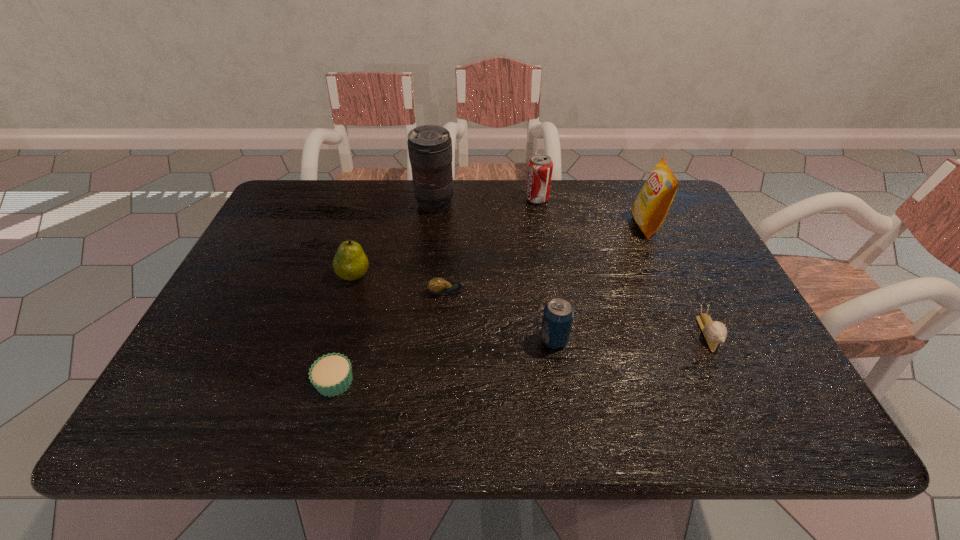
The image size is (960, 540). Find the location of `vacant region between the telephoto lens and the right escargot`. vacant region between the telephoto lens and the right escargot is located at coordinates (571, 268).

Locate an element on the screen. This screenshot has height=540, width=960. vacant space that's between the nearest object and the seventh shortest object is located at coordinates (491, 303).

Choose which object is the second nearest neighbor to the pear. Please provide its 2D coordinates. Your answer should be formatted as a tuple, i.e. [(x, y)], where the tuple contains the x and y coordinates of a point satisfying the conditions above.

[(429, 146)]

Where is `object that stands as the closest to the crisp (potato chip)`? object that stands as the closest to the crisp (potato chip) is located at coordinates (540, 167).

You are a GUI agent. You are given a task and a screenshot of the screen. Output one action in this format:
    pyautogui.click(x=<x>, y=<y>)
    Task: Click on the vacant position in the image that satisfies the following two spatial constraints: 1. on the front-facing side of the left escargot; 2. on the right side of the nearer pop soda
    
    Given the screenshot: What is the action you would take?
    pyautogui.click(x=445, y=339)

This screenshot has height=540, width=960. I want to click on vacant position in the image that satisfies the following two spatial constraints: 1. on the front-facing side of the crisp (potato chip); 2. on the front side of the pear, so click(668, 275).